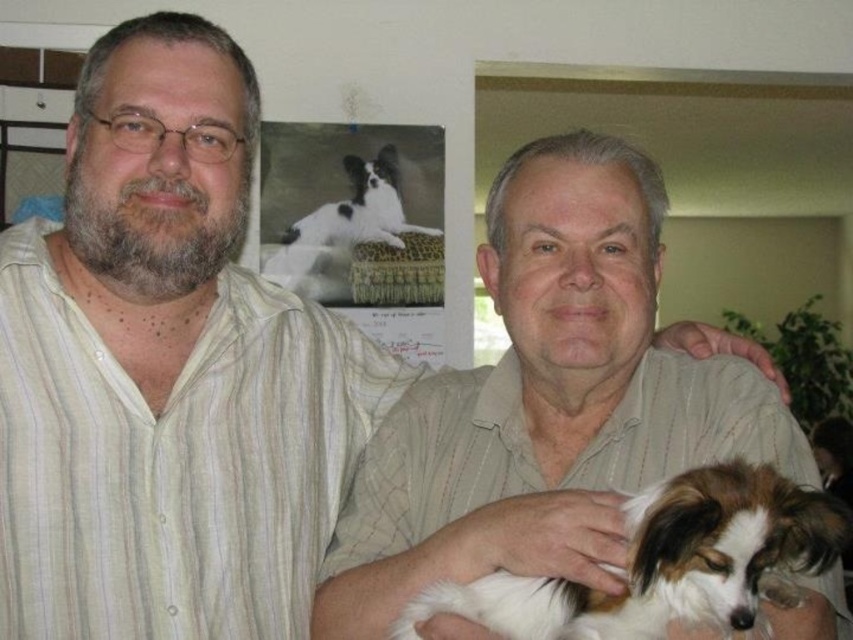
Question: Which of the following is the closest to the observer?

Choices:
 (A) black and white fur dog at upper center
 (B) light beige striped shirt at center

Answer: (B)

Question: Does white and brown fur dog at center have a greater width compared to black and white fur dog at upper center?

Choices:
 (A) no
 (B) yes

Answer: (A)

Question: Which object is positioned closest to the white and brown fur dog at center?

Choices:
 (A) light beige striped shirt at center
 (B) black and white fur dog at upper center

Answer: (A)

Question: Does white and brown fur dog at center appear under black and white fur dog at upper center?

Choices:
 (A) yes
 (B) no

Answer: (A)

Question: Can you confirm if white and brown fur dog at center is thinner than black and white fur dog at upper center?

Choices:
 (A) no
 (B) yes

Answer: (B)

Question: Among these points, which one is nearest to the camera?

Choices:
 (A) pos(529,628)
 (B) pos(563,422)

Answer: (A)